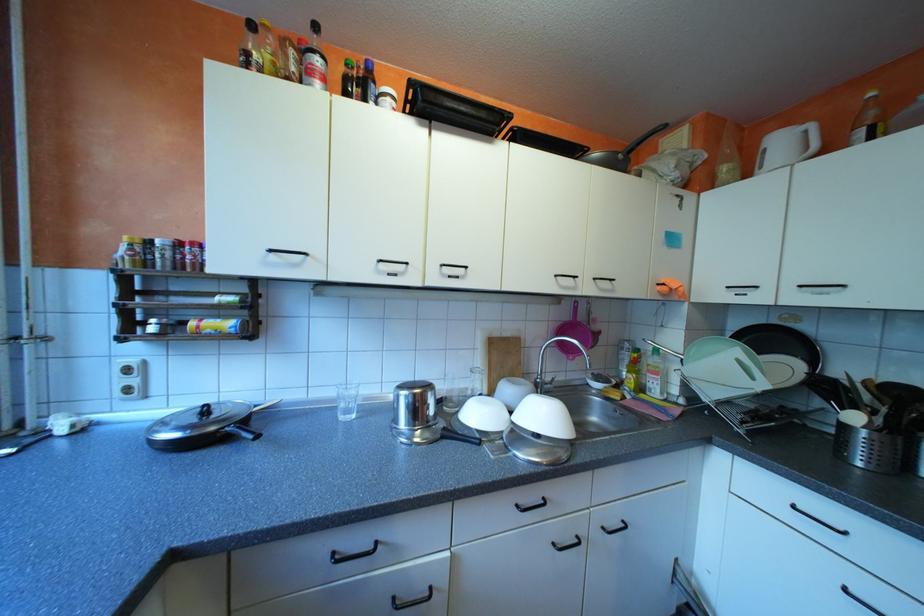
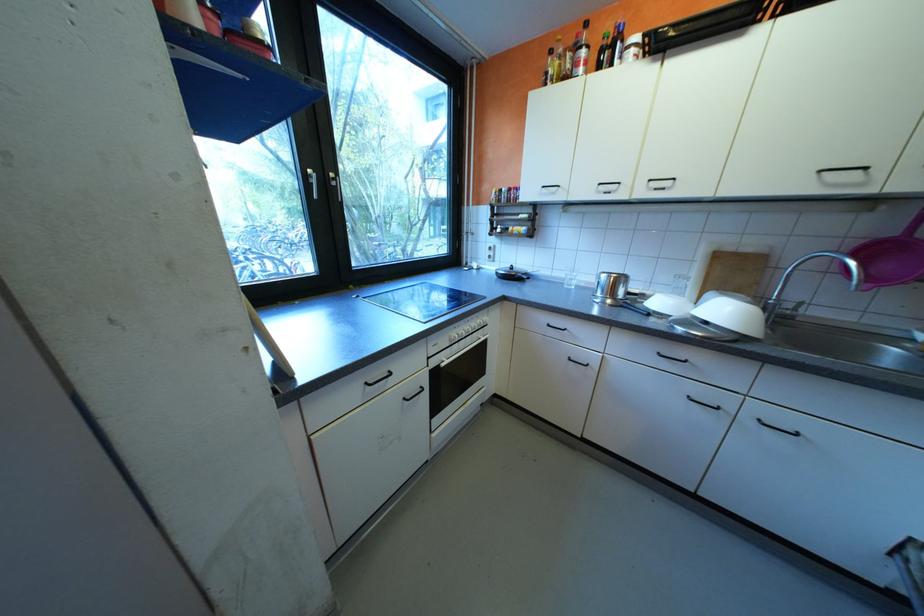
Locate, in the second image, the point that corresponds to (x=578, y=315) in the first image.

(906, 231)